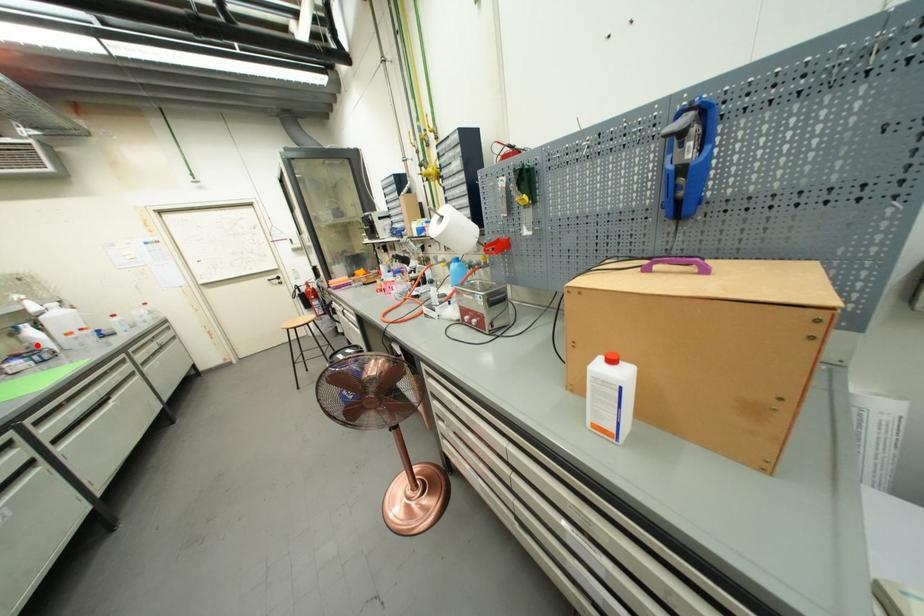
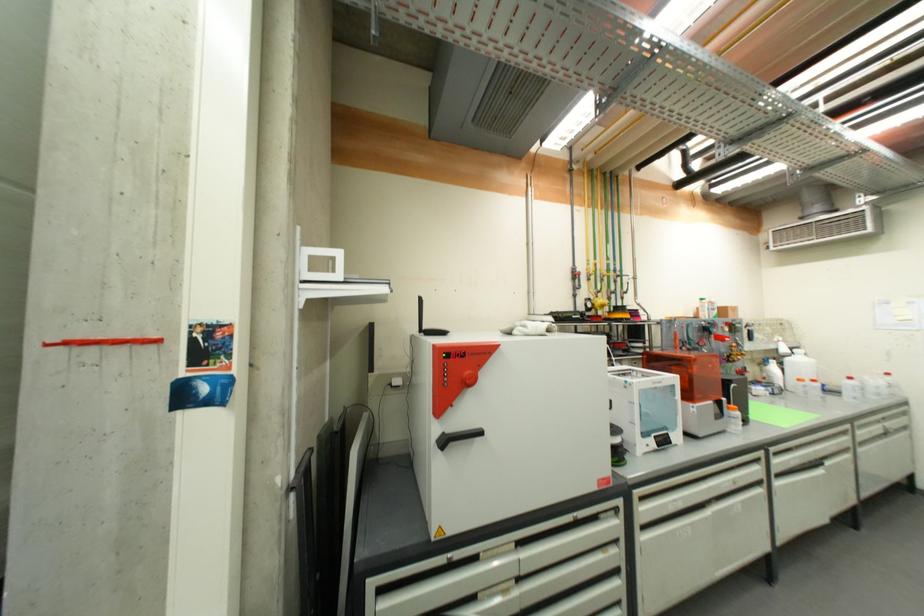
Locate, in the second image, the point that corresponds to the highlighted location in the first image.

(774, 378)